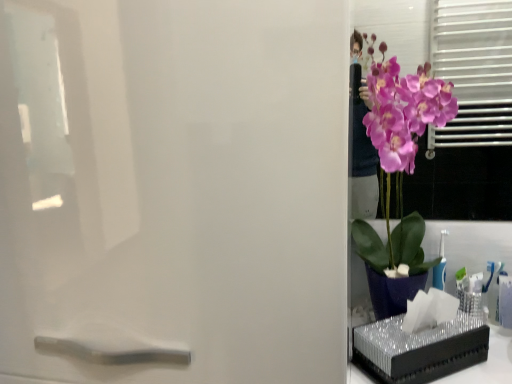
Question: Is the position of purple glossy orchid at right more distant than that of metallic silver tissue box at right?

Choices:
 (A) yes
 (B) no

Answer: (B)

Question: Does purple glossy orchid at right have a greater height compared to metallic silver tissue box at right?

Choices:
 (A) yes
 (B) no

Answer: (A)

Question: Is purple glossy orchid at right wider than metallic silver tissue box at right?

Choices:
 (A) yes
 (B) no

Answer: (A)

Question: Can you confirm if purple glossy orchid at right is thinner than metallic silver tissue box at right?

Choices:
 (A) no
 (B) yes

Answer: (A)

Question: From a real-world perspective, is purple glossy orchid at right under metallic silver tissue box at right?

Choices:
 (A) no
 (B) yes

Answer: (A)

Question: Is purple glossy orchid at right outside of metallic silver tissue box at right?

Choices:
 (A) no
 (B) yes

Answer: (B)

Question: Is metallic silver tissue box at right at the left side of purple glossy orchid at right?

Choices:
 (A) yes
 (B) no

Answer: (B)

Question: Does metallic silver tissue box at right contain purple glossy orchid at right?

Choices:
 (A) yes
 (B) no

Answer: (B)

Question: Is metallic silver tissue box at right wider than purple glossy orchid at right?

Choices:
 (A) no
 (B) yes

Answer: (A)

Question: Considering the relative sizes of metallic silver tissue box at right and purple glossy orchid at right in the image provided, is metallic silver tissue box at right bigger than purple glossy orchid at right?

Choices:
 (A) yes
 (B) no

Answer: (B)

Question: Does metallic silver tissue box at right have a lesser height compared to purple glossy orchid at right?

Choices:
 (A) yes
 (B) no

Answer: (A)

Question: From a real-world perspective, is metallic silver tissue box at right positioned over purple glossy orchid at right based on gravity?

Choices:
 (A) yes
 (B) no

Answer: (B)

Question: Is satin white screen door at right at the right side of purple glossy orchid at right?

Choices:
 (A) no
 (B) yes

Answer: (A)